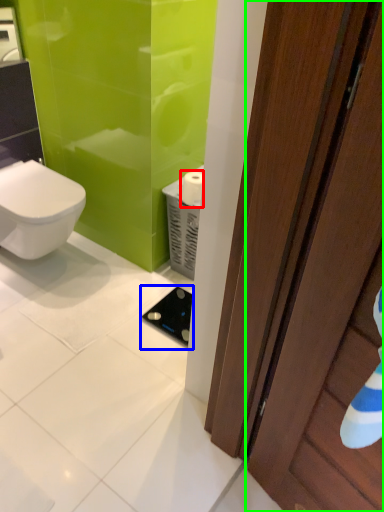
Question: Which object is the closest to the toilet paper (highlighted by a red box)? Choose among these: appliance (highlighted by a blue box) or door (highlighted by a green box).

Choices:
 (A) appliance
 (B) door

Answer: (A)